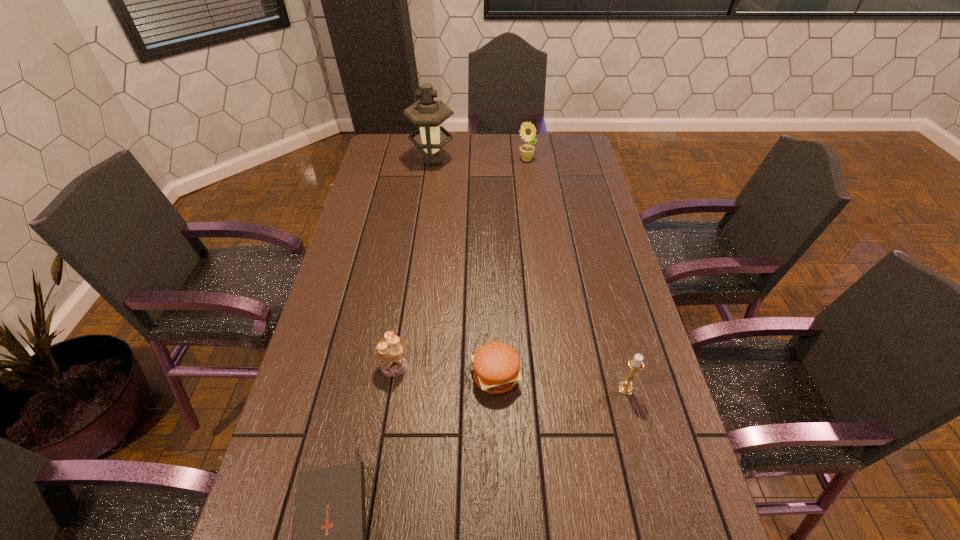
Find the location of `object that ranks as the second closest to the left candle holder`. object that ranks as the second closest to the left candle holder is located at coordinates (329, 539).

This screenshot has height=540, width=960. I want to click on blank space that satisfies the following two spatial constraints: 1. on the front side of the oil lamp; 2. on the right side of the third object from right to left, so click(x=403, y=376).

The width and height of the screenshot is (960, 540). Find the location of `vacant space that satisfies the following two spatial constraints: 1. on the face of the sunflower; 2. on the left side of the rightmost object`. vacant space that satisfies the following two spatial constraints: 1. on the face of the sunflower; 2. on the left side of the rightmost object is located at coordinates (557, 389).